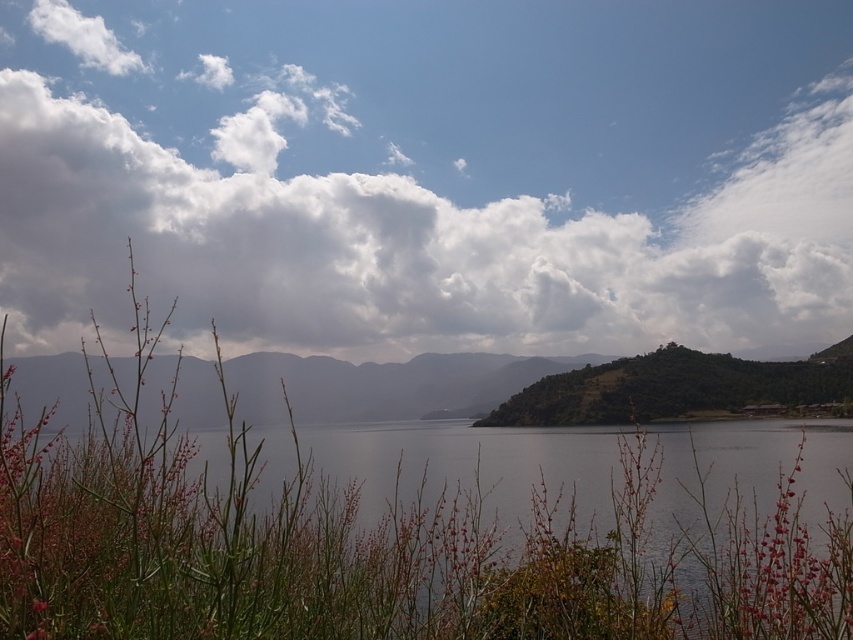
You are an artist sketching the landscape and want to capture the relationship between the white fluffy cloud at upper center and the green textured hillside at center. Which object is located to the right of the other?

The white fluffy cloud at upper center is positioned on the right side of green textured hillside at center.

You are standing at the lakeside and want to know if you can see the white fluffy cloud at upper center from your current position. The smooth gray water at center is reflecting the sky. Can you see the cloud reflected in the water?

Yes, because the distance between the white fluffy cloud at upper center and the smooth gray water at center is 48.03 meters, which allows the reflection to be visible on the water surface.

Consider the image. You are an artist trying to paint the scene. You want to ensure the white fluffy cloud at upper center and smooth gray water at center are proportionally accurate. Based on the description, which object should you make wider in your painting?

The white fluffy cloud at upper center might be wider than smooth gray water at center, so you should make the white fluffy cloud at upper center wider in your painting.